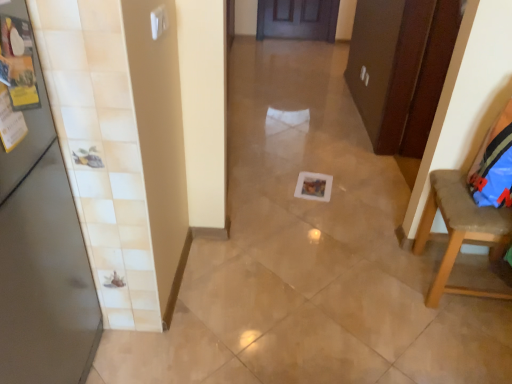
The image size is (512, 384). Identify the location of vacant space that is to the left of brown fabric chair at right. (377, 286).